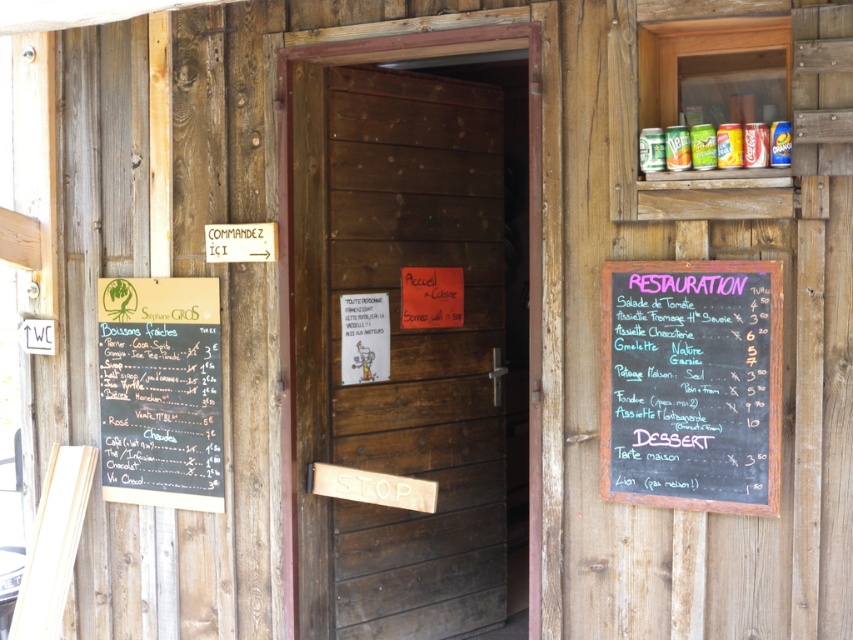
The image size is (853, 640). What do you see at coordinates (691, 385) in the screenshot?
I see `black chalkboard at right` at bounding box center [691, 385].

How distant is black chalkboard at right from black chalkboard menu at left?

black chalkboard at right is 1.91 meters away from black chalkboard menu at left.

Between point (610, 333) and point (142, 324), which one is positioned in front?

Point (610, 333)

Locate an element on the screen. This screenshot has width=853, height=640. black chalkboard at right is located at coordinates (691, 385).

Does point (378, 193) come closer to viewer compared to point (621, 296)?

No, it is behind (621, 296).

Describe the element at coordinates (401, 349) in the screenshot. I see `dark wood door at center` at that location.

I want to click on dark wood door at center, so click(401, 349).

Who is lower down, dark wood door at center or black chalkboard menu at left?

black chalkboard menu at left

Is dark wood door at center shorter than black chalkboard menu at left?

No.

Measure the distance between dark wood door at center and camera.

The distance of dark wood door at center from camera is 14.44 feet.

This screenshot has width=853, height=640. In order to click on dark wood door at center in this screenshot , I will do tap(401, 349).